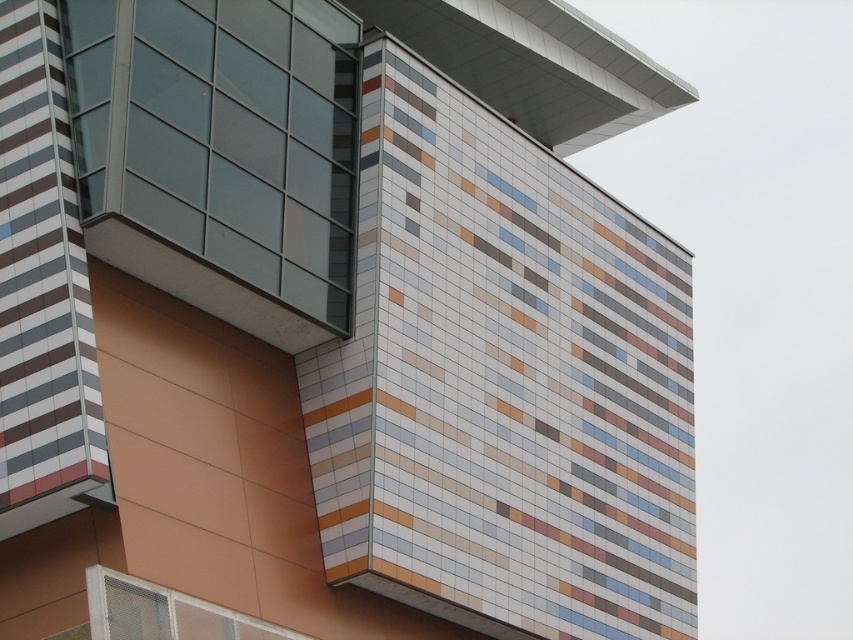
In the scene shown: You are an architect reviewing the building plans and need to determine the coordinates of the transparent glass window at upper left. What are its coordinates?

The transparent glass window at upper left is located at point (219, 154).

You are an architect analyzing the building facade. You need to determine the spatial relationship between the transparent glass window at upper left and the white mesh window at lower left. Which one is located to the left of the other?

The transparent glass window at upper left is positioned on the left side of white mesh window at lower left, meaning it is more to the left compared to the white mesh window at lower left.